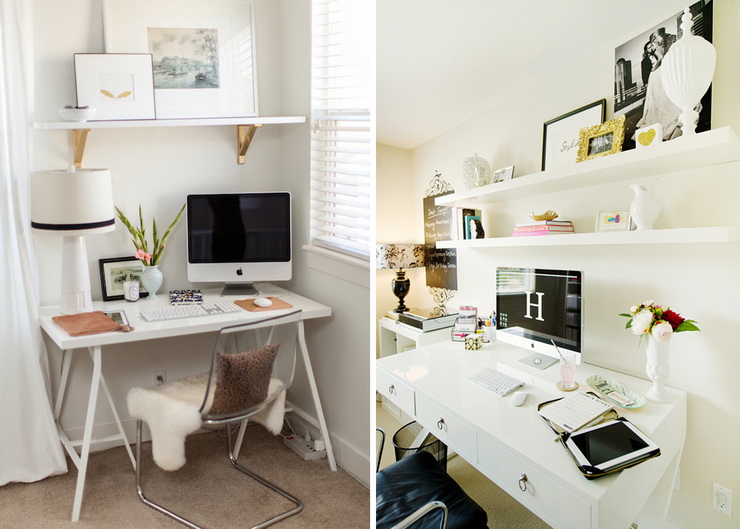
Where is `pictures`? The width and height of the screenshot is (740, 529). pictures is located at coordinates (238, 61), (553, 129), (645, 45), (131, 83).